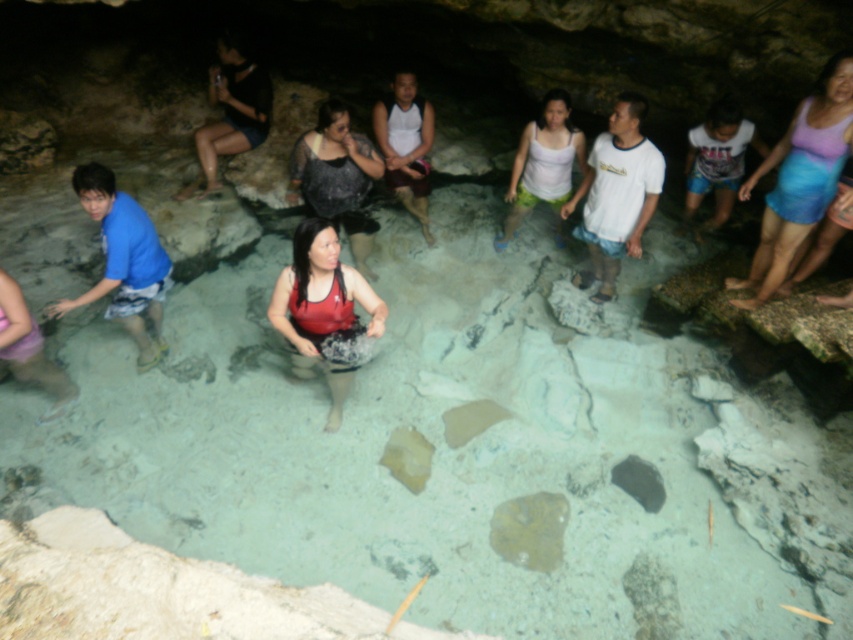
Question: Which object appears farthest from the camera in this image?

Choices:
 (A) white cotton tank top at center
 (B) matte black dress at center
 (C) matte red tank top at center

Answer: (A)

Question: Can you confirm if matte black dress at center is positioned below white cotton tank top at center?

Choices:
 (A) no
 (B) yes

Answer: (B)

Question: Which object is closer to the camera taking this photo?

Choices:
 (A) white cotton tank top at center
 (B) matte red tank top at center
 (C) purple fabric skirt at upper right

Answer: (C)

Question: In this image, where is matte black dress at center located relative to white cotton tank top at center?

Choices:
 (A) left
 (B) right

Answer: (A)

Question: Does matte black dress at center appear on the left side of white cotton tank top at center?

Choices:
 (A) no
 (B) yes

Answer: (B)

Question: Which object appears closest to the camera in this image?

Choices:
 (A) white cotton tank top at center
 (B) purple fabric skirt at upper right
 (C) matte black dress at center

Answer: (B)